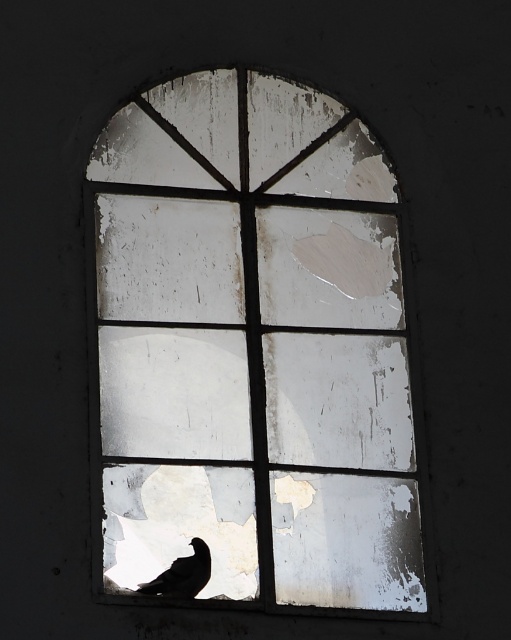
Which is behind, point (110, 508) or point (173, 570)?

The point (110, 508) is behind.

Which is in front, point (98, 474) or point (207, 547)?

Point (98, 474)

Is point (280, 480) positioned after point (207, 554)?

That is True.

Find the location of a particular element. The height and width of the screenshot is (640, 511). white peeling paint window at center is located at coordinates (252, 348).